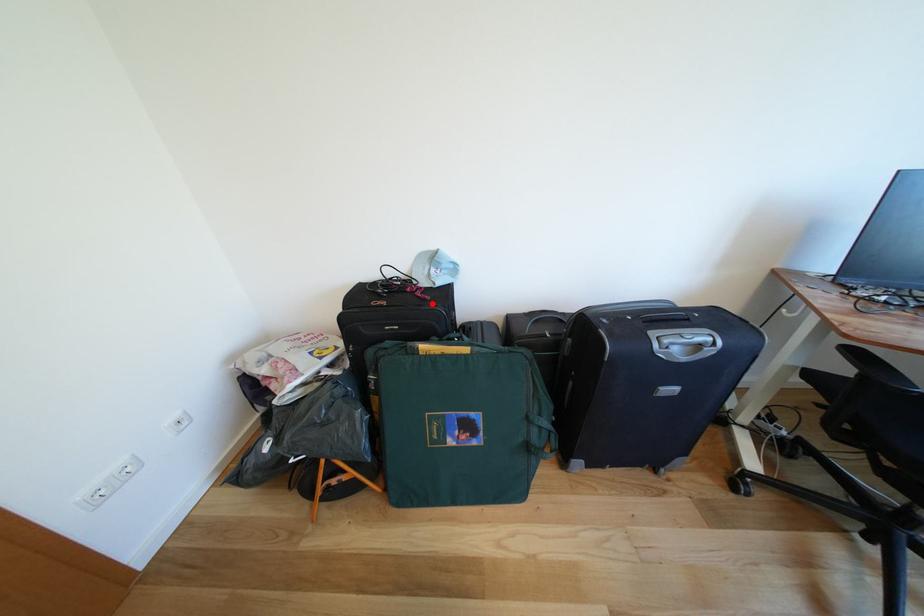
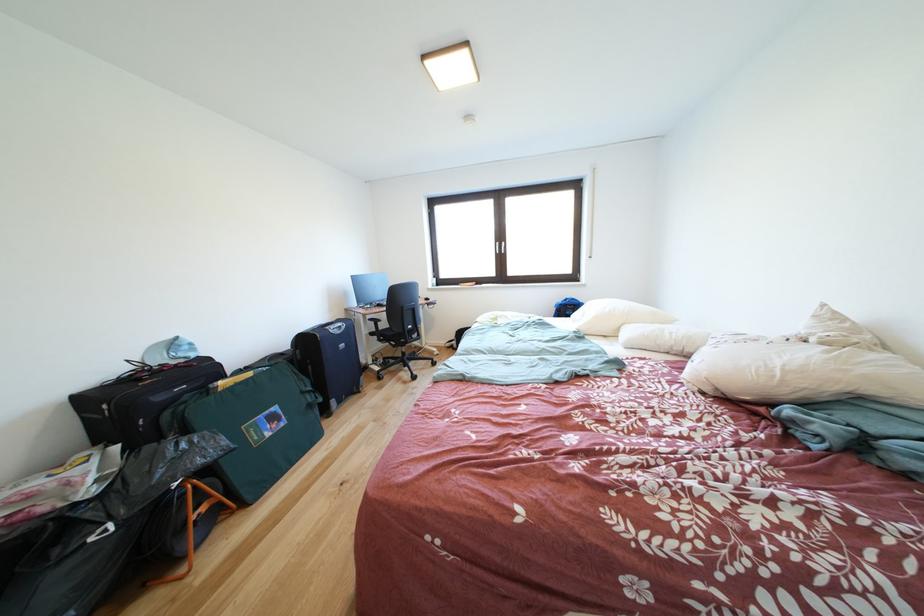
Where in the second image is the point corresponding to the highlighted location from the first image?

(200, 371)